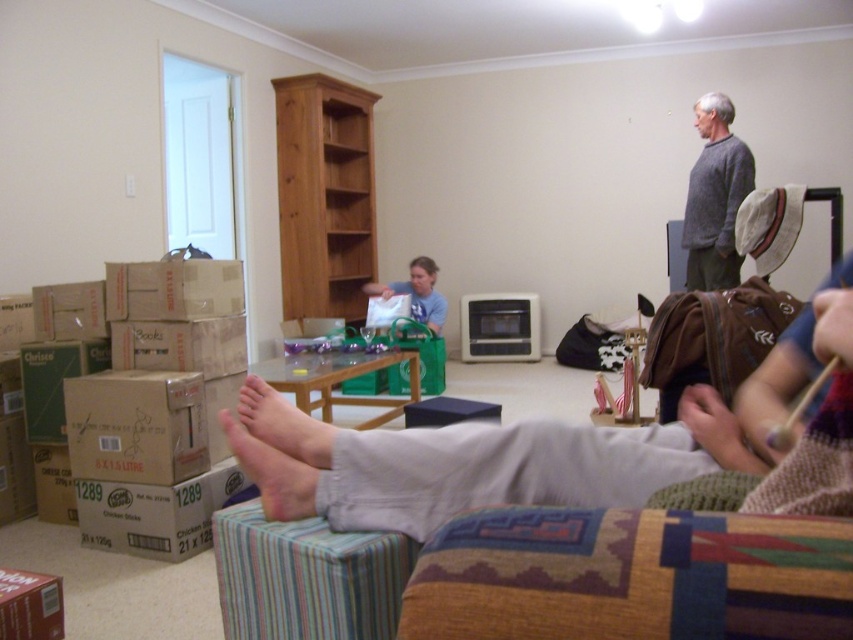
Which is more to the left, smooth skin foot at lower center or matte gray shirt at center?

smooth skin foot at lower center is more to the left.

Who is more distant from viewer, (247,472) or (438,305)?

The point (438,305) is behind.

You are a GUI agent. You are given a task and a screenshot of the screen. Output one action in this format:
    pyautogui.click(x=<x>, y=<y>)
    Task: Click on the smooth skin foot at lower center
    This screenshot has width=853, height=640.
    Given the screenshot: What is the action you would take?
    pyautogui.click(x=271, y=474)

Which is above, striped fabric stool at lower center or gray sweater at upper right?

Positioned higher is gray sweater at upper right.

Is striped fabric stool at lower center to the left of gray sweater at upper right from the viewer's perspective?

Indeed, striped fabric stool at lower center is positioned on the left side of gray sweater at upper right.

Between point (225, 605) and point (717, 244), which one is positioned behind?

Positioned behind is point (717, 244).

The height and width of the screenshot is (640, 853). Identify the location of striped fabric stool at lower center. (305, 577).

Can you confirm if light beige skin at lower center is smaller than matte gray shirt at center?

Yes.

Between point (273, 388) and point (440, 324), which one is positioned behind?

Point (440, 324)

Find the location of a particular element. This screenshot has width=853, height=640. light beige skin at lower center is located at coordinates (283, 424).